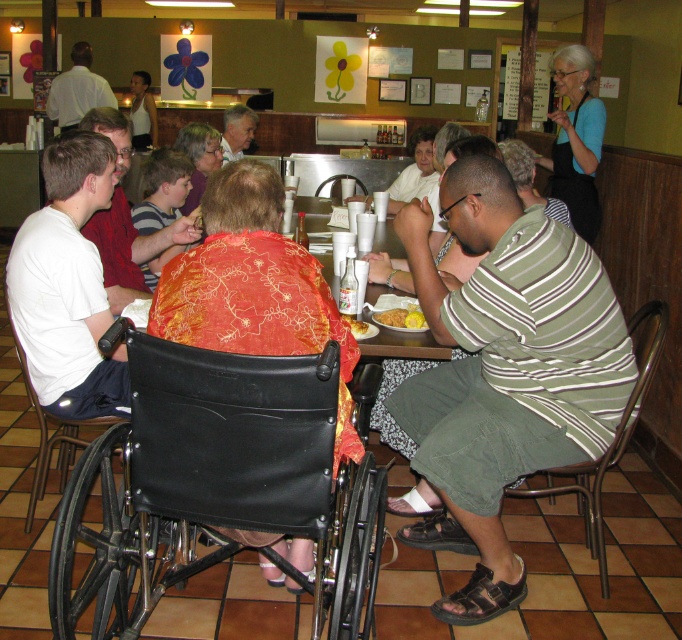
Based on the coordinates provided, where is the yellow matte cornbread at center located in the image?

The yellow matte cornbread at center is located at the coordinates point (400, 317).

You are a server in a restaurant and need to place a 30 cm wide menu between the white cotton shirt at left and the matte red shirt at center. Can the menu fit between them without overlapping either shirt?

The white cotton shirt at left and matte red shirt at center are 32.89 centimeters apart, so the 30 cm wide menu can fit between them without overlapping either shirt.